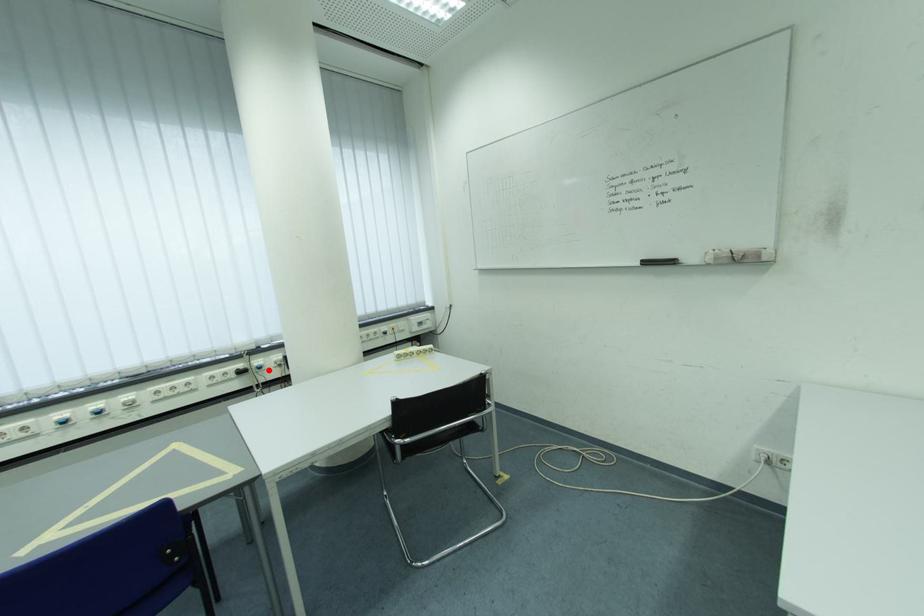
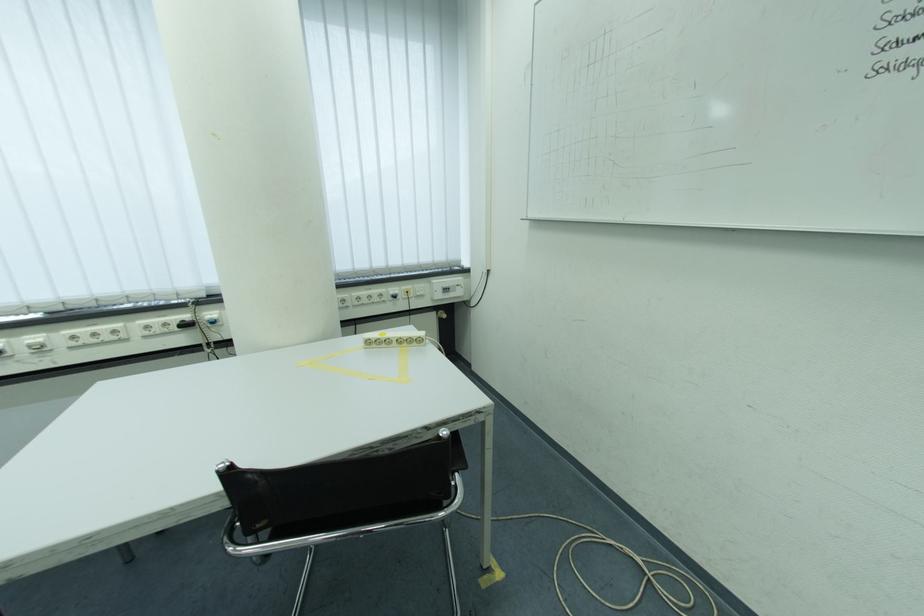
Find the pixel in the second image that matches the highlighted location in the first image.

(223, 325)